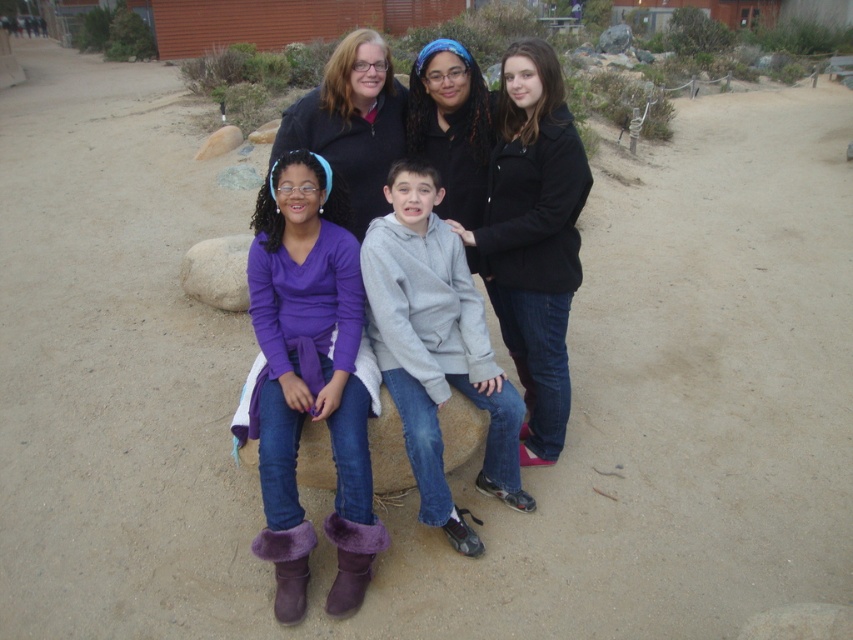
Can you confirm if purple fuzzy boots at lower center is shorter than matte black jacket at upper center?

Incorrect, purple fuzzy boots at lower center's height does not fall short of matte black jacket at upper center's.

Is purple fuzzy boots at lower center to the left of matte black jacket at upper center from the viewer's perspective?

Yes, purple fuzzy boots at lower center is to the left of matte black jacket at upper center.

The height and width of the screenshot is (640, 853). Identify the location of purple fuzzy boots at lower center. pyautogui.click(x=310, y=378).

Which is in front, point (428, 276) or point (398, 113)?

Point (428, 276) is in front.

Does gray fleece hoodie at center appear on the right side of matte black jacket at upper center?

Correct, you'll find gray fleece hoodie at center to the right of matte black jacket at upper center.

Locate an element on the screen. gray fleece hoodie at center is located at coordinates [436, 348].

Where is `gray fleece hoodie at center`? The width and height of the screenshot is (853, 640). gray fleece hoodie at center is located at coordinates (436, 348).

Does point (553, 140) lie in front of point (207, 284)?

Yes, point (553, 140) is closer to viewer.

Which is behind, point (540, 64) or point (183, 268)?

The point (183, 268) is behind.

Which is in front, point (560, 355) or point (228, 260)?

Point (560, 355) is more forward.

The width and height of the screenshot is (853, 640). Find the location of `black matte jacket at upper right`. black matte jacket at upper right is located at coordinates (532, 236).